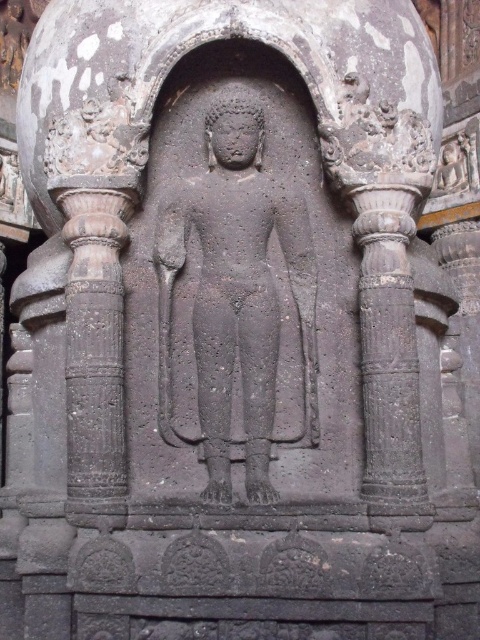
You are a GUI agent. You are given a task and a screenshot of the screen. Output one action in this format:
    pyautogui.click(x=<x>, y=<y>)
    Task: Click on the black stone statue at center
    Image resolution: width=480 pixels, height=640 pixels.
    Given the screenshot: What is the action you would take?
    236,296

Does black stone statue at center have a smaller size compared to dark gray stone column at left?

Actually, black stone statue at center might be larger than dark gray stone column at left.

Is point (243, 448) farther from camera compared to point (117, 339)?

Yes, it is behind point (117, 339).

Image resolution: width=480 pixels, height=640 pixels. Find the location of `black stone statue at center`. black stone statue at center is located at coordinates (236, 296).

Can you confirm if dark gray stone column at left is positioned to the right of dark gray stone column at right?

In fact, dark gray stone column at left is to the left of dark gray stone column at right.

Measure the distance between dark gray stone column at left and dark gray stone column at right.

dark gray stone column at left is 16.85 inches from dark gray stone column at right.

Between point (81, 384) and point (369, 372), which one is positioned in front?

Point (81, 384) is more forward.

The height and width of the screenshot is (640, 480). I want to click on dark gray stone column at left, so click(95, 355).

Which is more to the right, black stone statue at center or dark gray stone column at right?

Positioned to the right is dark gray stone column at right.

Which is in front, point (172, 438) or point (398, 252)?

Positioned in front is point (398, 252).

Image resolution: width=480 pixels, height=640 pixels. I want to click on black stone statue at center, so click(236, 296).